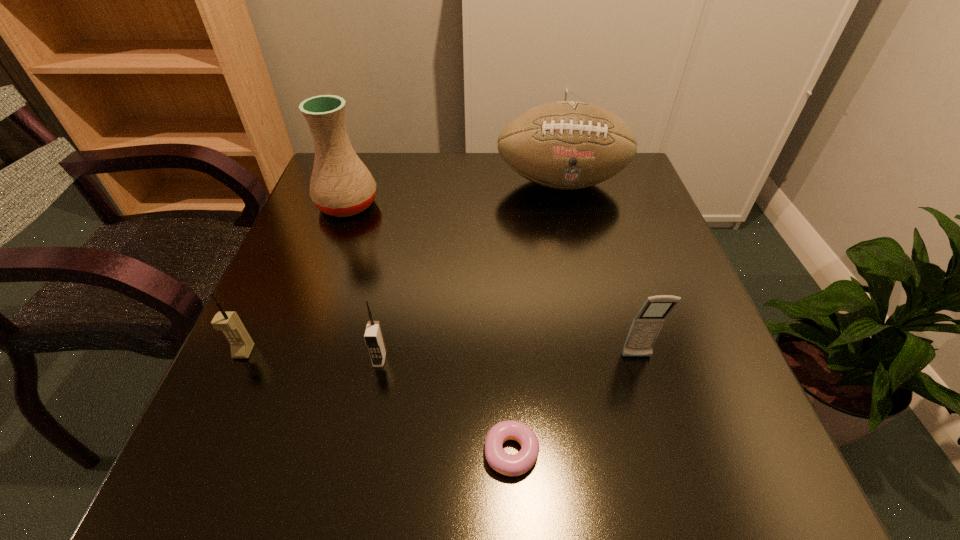
You are a GUI agent. You are given a task and a screenshot of the screen. Output one action in this format:
    pyautogui.click(x=<x>, y=<y>)
    Task: Click on the object situated at the far left corner
    This screenshot has height=540, width=960.
    Given the screenshot: What is the action you would take?
    pyautogui.click(x=341, y=185)

Identify the location of object present at the far right corner. (566, 145).

In the image, there is a desktop. Identify the location of vacant space at the far edge. This screenshot has height=540, width=960. (429, 154).

The width and height of the screenshot is (960, 540). Find the location of `vacant region at the near edge`. vacant region at the near edge is located at coordinates (346, 450).

The image size is (960, 540). Identify the location of free space at the left edge of the desktop. (x=346, y=239).

Find the location of a particular element. vacant space at the right edge of the desktop is located at coordinates (646, 222).

Identify the location of vacant space at the near left corner. The image size is (960, 540). (x=222, y=451).

In order to click on vacant area between the third object from left to right and the shortest object in this screenshot , I will do `click(445, 406)`.

Image resolution: width=960 pixels, height=540 pixels. What are the coordinates of `vacant region between the tallest object and the leftmost cellular telephone` in the screenshot? It's located at (296, 278).

The image size is (960, 540). In order to click on free space between the fifth shortest object and the nearest object in this screenshot , I will do `click(537, 318)`.